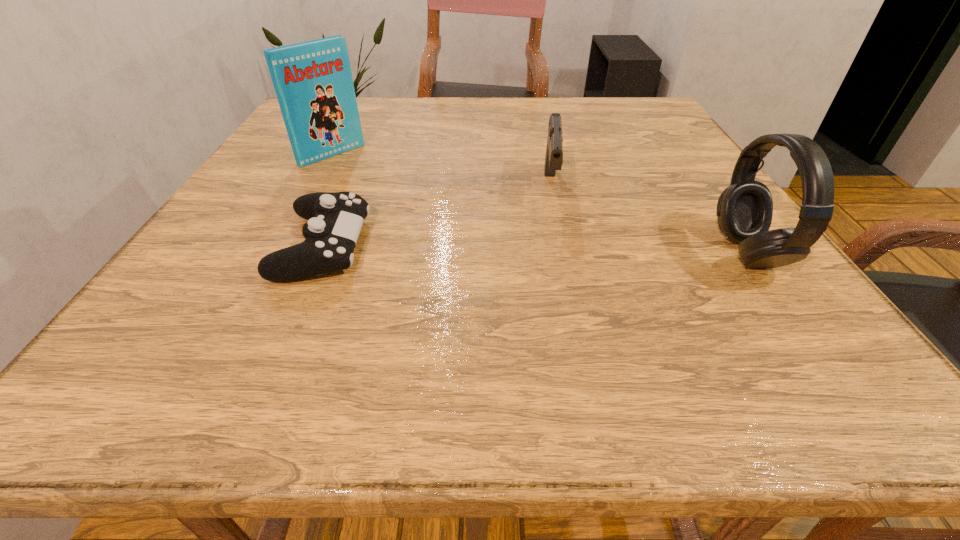
Image resolution: width=960 pixels, height=540 pixels. I want to click on vacant space on the desktop that is between the shortest object and the rightmost object and is positioned on the front cover of the book, so click(x=469, y=248).

This screenshot has width=960, height=540. I want to click on free space on the desktop that is between the shortest object and the rightmost object and is positioned aim along the barrel of the second object from right to left, so click(x=551, y=249).